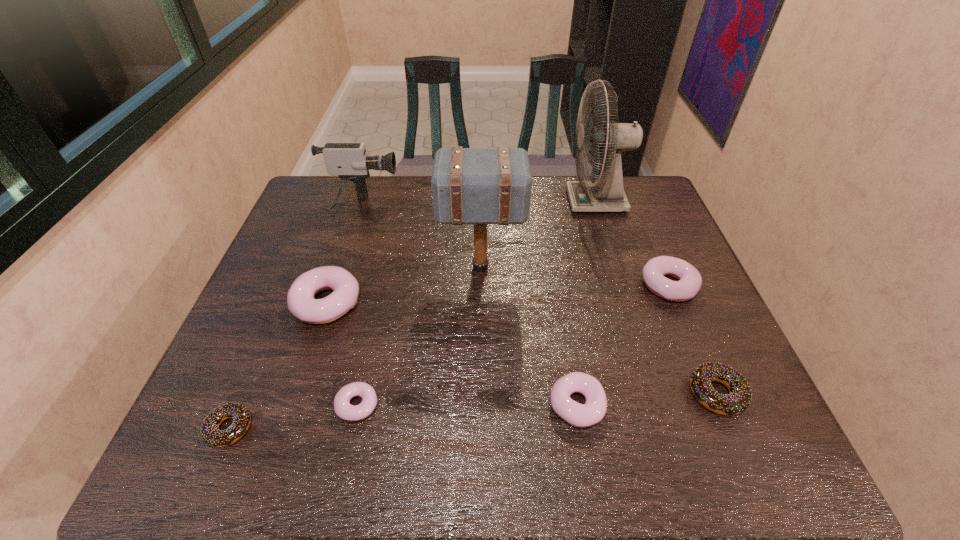
Where is `vacant space located 0.350m on the striking surface of the fifth object from left to right`? The width and height of the screenshot is (960, 540). vacant space located 0.350m on the striking surface of the fifth object from left to right is located at coordinates point(316,267).

Identify the location of blank area located on the recording direction of the camcorder. The image size is (960, 540). (496, 207).

This screenshot has width=960, height=540. Find the location of `vacant space situated 0.180m on the front of the biggest purple doughnut`. vacant space situated 0.180m on the front of the biggest purple doughnut is located at coordinates (296, 397).

What are the coordinates of `vacant area situated 0.100m on the left of the second tallest doughnut` in the screenshot? It's located at (603, 286).

Where is `blank area located 0.160m on the back of the fourth doughnut from left to right`? This screenshot has width=960, height=540. blank area located 0.160m on the back of the fourth doughnut from left to right is located at coordinates (563, 323).

The image size is (960, 540). I want to click on free region located on the back of the bigger chocolate doughnut, so click(x=683, y=312).

What are the coordinates of `free space located 0.230m on the left of the third doughnut from left to right` in the screenshot? It's located at (227, 405).

Find the location of `vacant region located 0.120m on the right of the left chocolate doughnut`. vacant region located 0.120m on the right of the left chocolate doughnut is located at coordinates (311, 428).

Image resolution: width=960 pixels, height=540 pixels. What are the coordinates of `fan at the far edge` in the screenshot? It's located at (607, 194).

The image size is (960, 540). I want to click on camcorder at the far edge, so click(x=349, y=161).